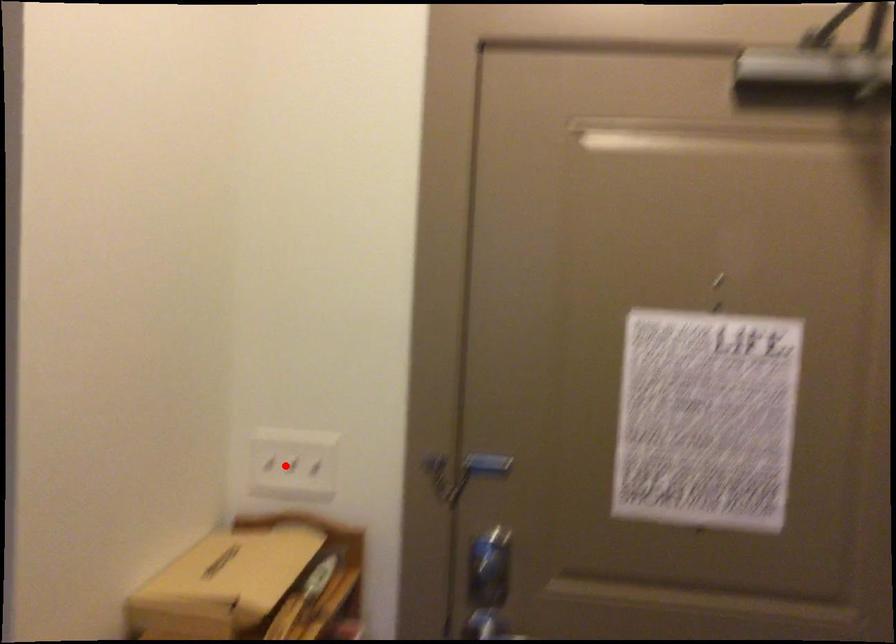
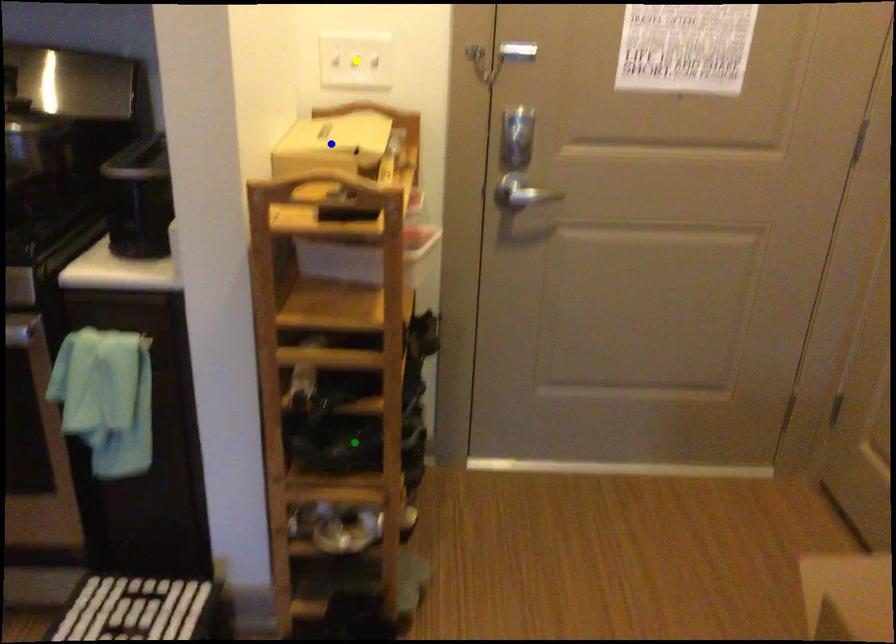
Question: I am providing you with two images of the same scene from different viewpoints. A red point is marked on the first image. You are given multiple points on the second image. In image 2, which mark is for the same physical point as the one in image 1?

Choices:
 (A) blue point
 (B) yellow point
 (C) green point

Answer: (B)